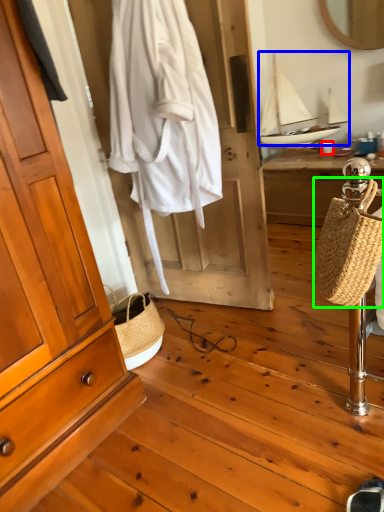
Question: Which object is positioned farthest from coffee cup (highlighted by a red box)? Select from sailboat (highlighted by a blue box) and handbag (highlighted by a green box).

Choices:
 (A) sailboat
 (B) handbag

Answer: (B)